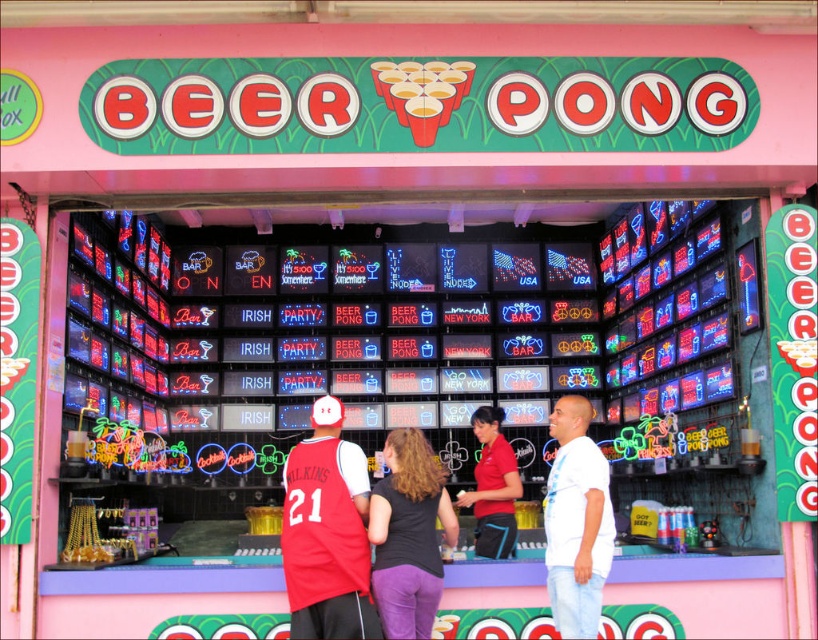
Question: Does red jersey at center appear under red fabric shirt at center?

Choices:
 (A) yes
 (B) no

Answer: (B)

Question: Is white cotton shirt at center smaller than red fabric shirt at center?

Choices:
 (A) yes
 (B) no

Answer: (A)

Question: Which of the following is the farthest from the observer?

Choices:
 (A) red fabric shirt at center
 (B) white cotton shirt at center
 (C) red jersey at center

Answer: (A)

Question: Considering the real-world distances, which object is closest to the red jersey at center?

Choices:
 (A) white cotton shirt at center
 (B) red fabric shirt at center
 (C) black fabric shirt at center

Answer: (C)

Question: Among these points, which one is farthest from the camera?

Choices:
 (A) (509, 445)
 (B) (569, 593)
 (C) (322, 600)

Answer: (A)

Question: Can you confirm if white cotton shirt at center is thinner than red fabric shirt at center?

Choices:
 (A) yes
 (B) no

Answer: (A)